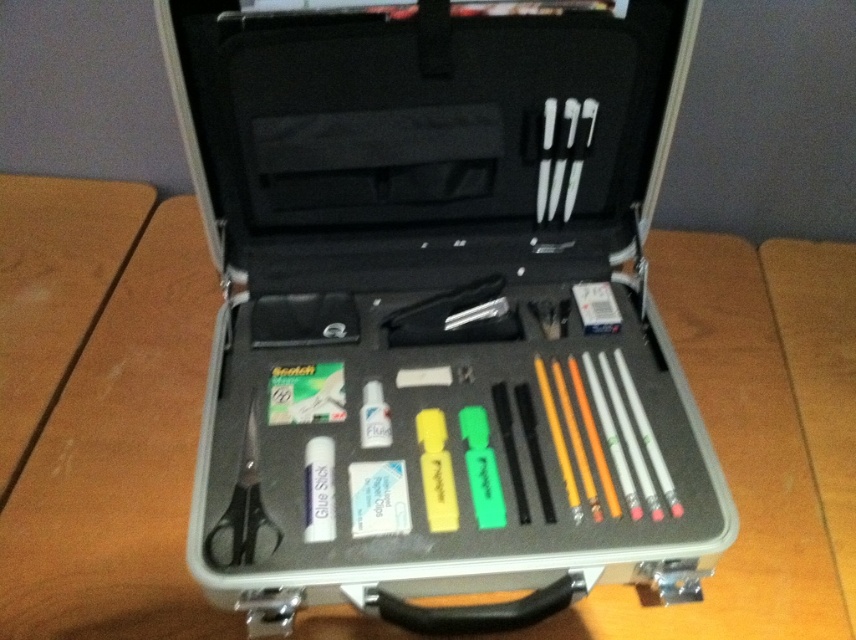
Does point (257, 371) come farther from viewer compared to point (590, 122)?

Yes, point (257, 371) is farther from viewer.

Is silver metallic briefcase at center below white plastic screwdriver at upper right?

Indeed, silver metallic briefcase at center is positioned under white plastic screwdriver at upper right.

The width and height of the screenshot is (856, 640). What do you see at coordinates (438, 307) in the screenshot? I see `silver metallic briefcase at center` at bounding box center [438, 307].

You are a GUI agent. You are given a task and a screenshot of the screen. Output one action in this format:
    pyautogui.click(x=<x>, y=<y>)
    Task: Click on the silver metallic briefcase at center
    The height and width of the screenshot is (640, 856).
    Given the screenshot: What is the action you would take?
    pyautogui.click(x=438, y=307)

Which is below, silver metallic briefcase at center or white plastic eraser at center?

Positioned lower is white plastic eraser at center.

Where is `silver metallic briefcase at center`? silver metallic briefcase at center is located at coordinates (438, 307).

Measure the distance between silver metallic briefcase at center and camera.

The distance of silver metallic briefcase at center from camera is 28.60 inches.

This screenshot has height=640, width=856. Find the location of `silver metallic briefcase at center`. silver metallic briefcase at center is located at coordinates (438, 307).

Can you confirm if black plastic scissors at left is bigger than white plastic screwdriver at upper right?

Yes, black plastic scissors at left is bigger than white plastic screwdriver at upper right.

Is black plastic scissors at left further to camera compared to white plastic screwdriver at upper right?

No, black plastic scissors at left is closer to the viewer.

The height and width of the screenshot is (640, 856). I want to click on black plastic scissors at left, so click(x=242, y=513).